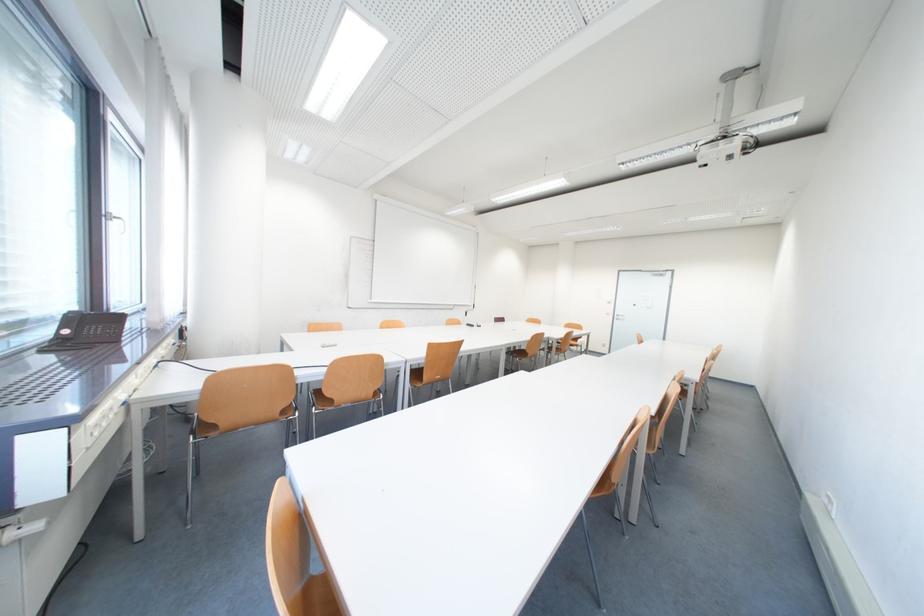
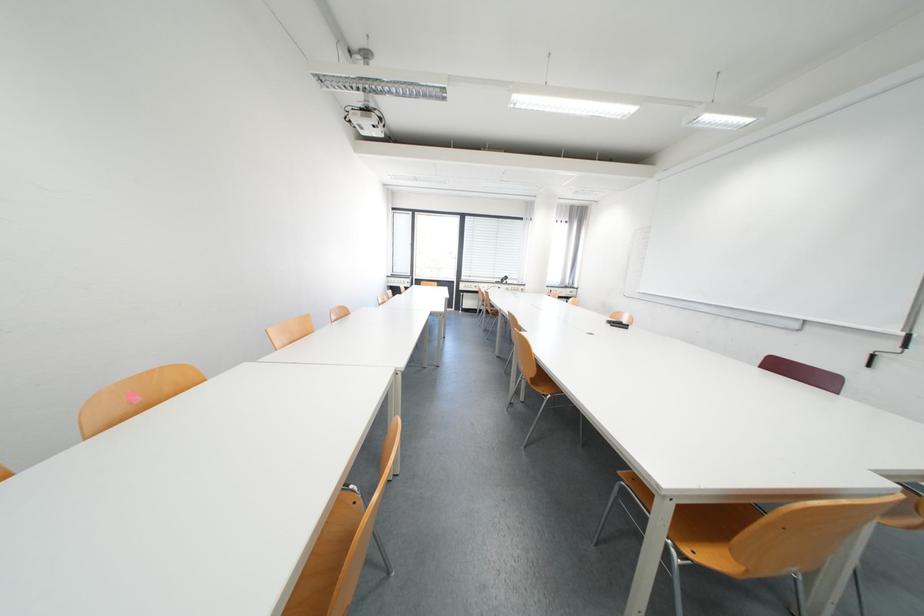
Question: I am providing you with two images of the same scene from different viewpoints. Which of the following objects are not visible in image2?

Choices:
 (A) black pen holder
 (B) chair sitting surface
 (C) whiteboard crank handle
 (D) brown chair sitting surface

Answer: (D)